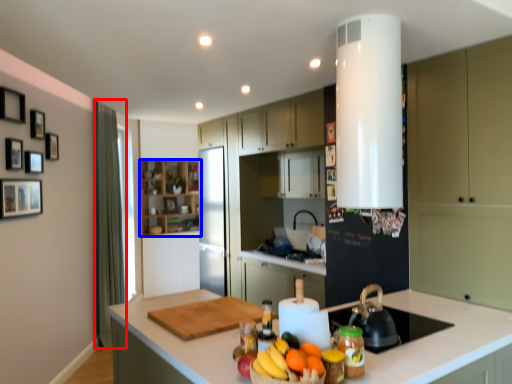
Question: Which of the following is the closest to the observer, curtain (highlighted by a red box) or cabinetry (highlighted by a blue box)?

Choices:
 (A) curtain
 (B) cabinetry

Answer: (A)